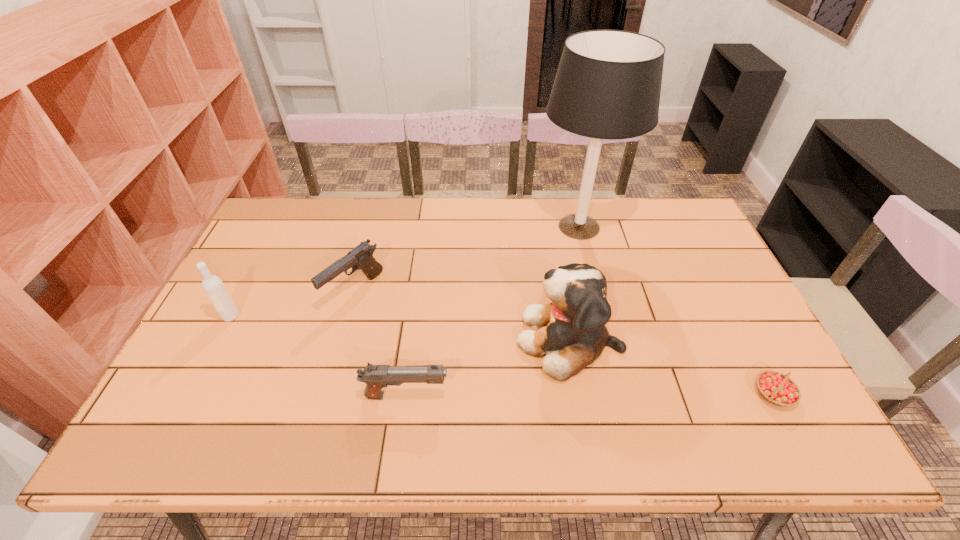
Where is `free space between the tallest object and the vodka`? Image resolution: width=960 pixels, height=540 pixels. free space between the tallest object and the vodka is located at coordinates coord(405,272).

Locate an element on the screen. The width and height of the screenshot is (960, 540). free space between the farthest object and the leftmost object is located at coordinates (405, 272).

The height and width of the screenshot is (540, 960). I want to click on empty space that is in between the farthest object and the rightmost object, so click(x=676, y=310).

Identify the location of unoccupied position between the puppy and the shortest object. (671, 367).

Locate an element on the screen. The width and height of the screenshot is (960, 540). blank region between the shortest object and the nearer gun is located at coordinates (589, 395).

Where is `vacant space in between the left gun and the fourth shortest object`? vacant space in between the left gun and the fourth shortest object is located at coordinates (293, 303).

You are a GUI agent. You are given a task and a screenshot of the screen. Output one action in this format:
    pyautogui.click(x=<x>, y=<y>)
    Task: Click on the vacant region between the tallest object and the left gun
    
    Given the screenshot: What is the action you would take?
    pyautogui.click(x=467, y=259)

At what (x,y) coordinates should I click in order to perform the action: click on free point between the farther gun and the tallest object. Please return your answer as a coordinate pair (x, y). The width and height of the screenshot is (960, 540). Looking at the image, I should click on (467, 259).

Identify which object is the second nearest to the leftmost object. Please provide its 2D coordinates. Your answer should be formatted as a tuple, i.e. [(x, y)], where the tuple contains the x and y coordinates of a point satisfying the conditions above.

[(376, 377)]

Point out which object is positioned as the nearest to the fifth object from right to left. Please provide its 2D coordinates. Your answer should be formatted as a tuple, i.e. [(x, y)], where the tuple contains the x and y coordinates of a point satisfying the conditions above.

[(213, 286)]